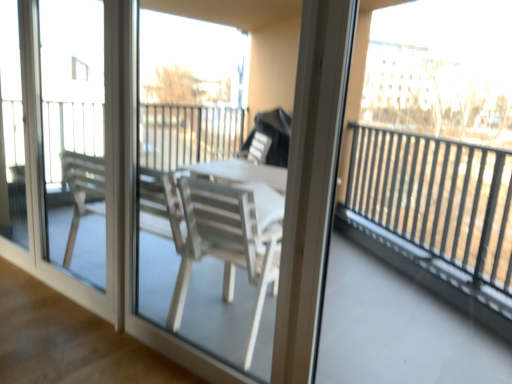
Locate an element on the screen. The image size is (512, 384). transparent glass at right is located at coordinates (438, 151).

Describe the element at coordinates (438, 151) in the screenshot. Image resolution: width=512 pixels, height=384 pixels. I see `transparent glass at right` at that location.

I want to click on transparent glass at right, so click(x=438, y=151).